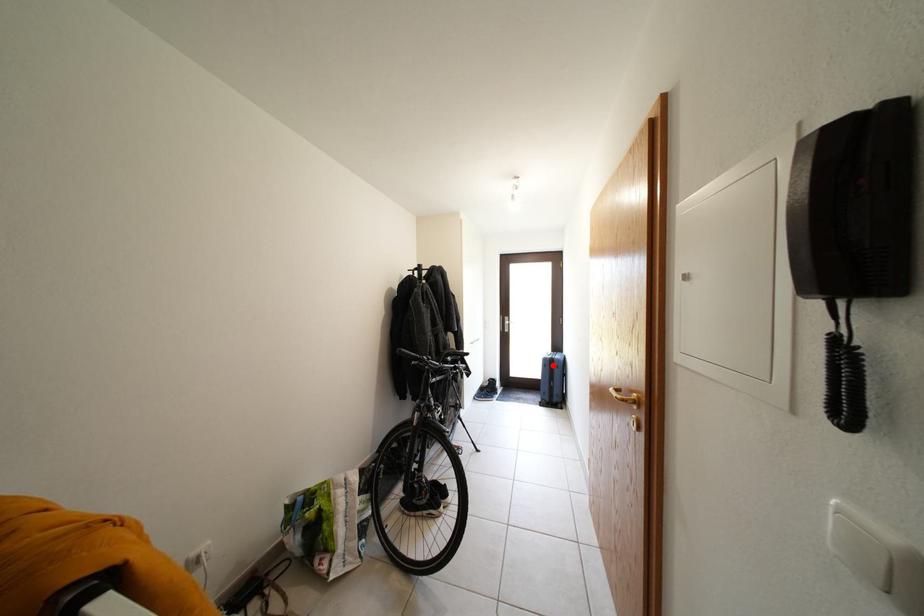
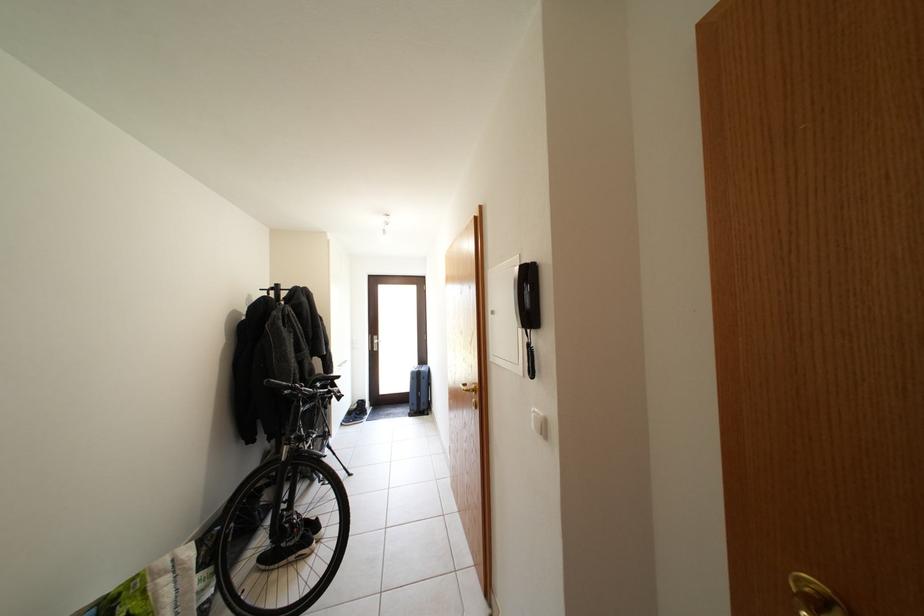
In the second image, find the point that corresponds to the highlighted location in the first image.

(420, 379)